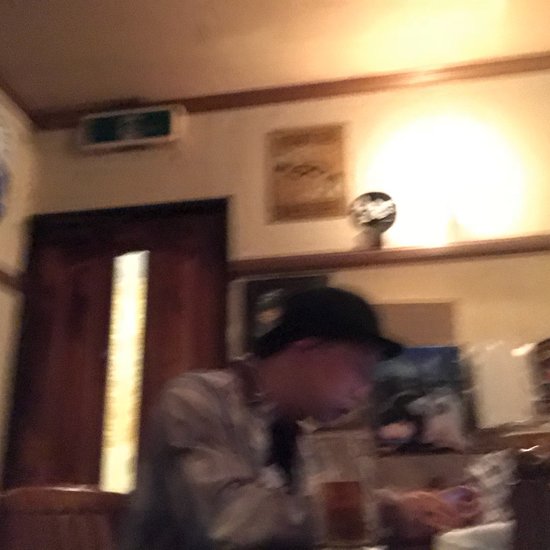
The image size is (550, 550). I want to click on back of chair, so click(50, 500).